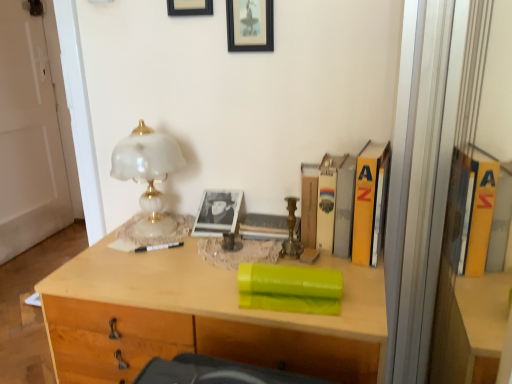
This screenshot has height=384, width=512. What are the coordinates of `vacant area that is in front of yellow matte book at right` in the screenshot? It's located at (361, 280).